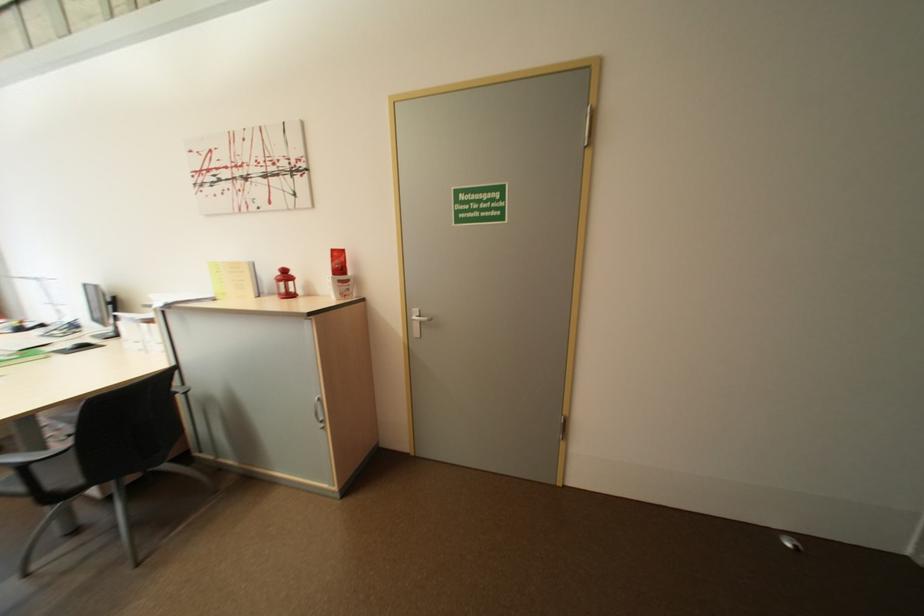
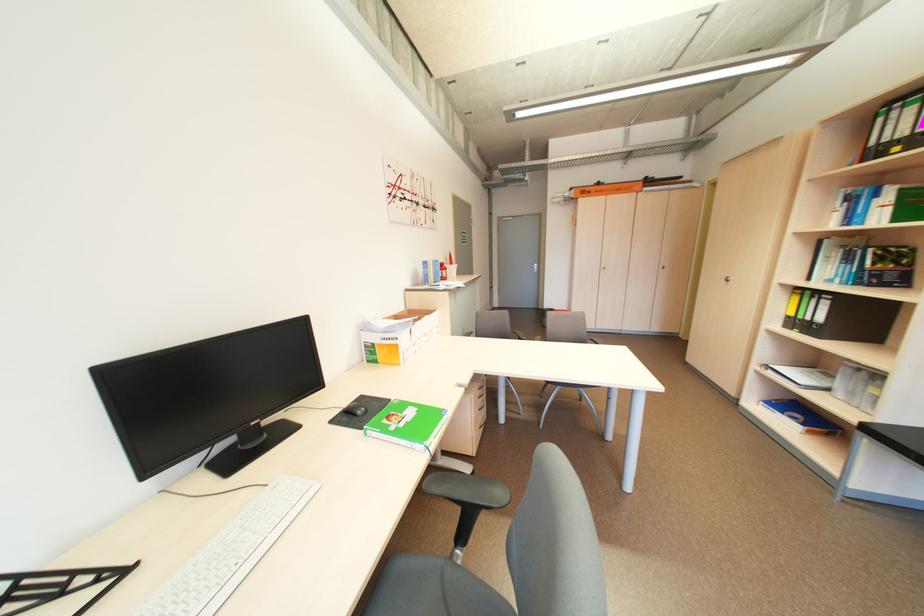
Question: I am providing you with two images of the same scene from different viewpoints. Which of the following objects are not visible in image2?

Choices:
 (A) grey towel rack
 (B) black chair armrest
 (C) chair armrest
 (D) silver cabinet handle

Answer: (C)